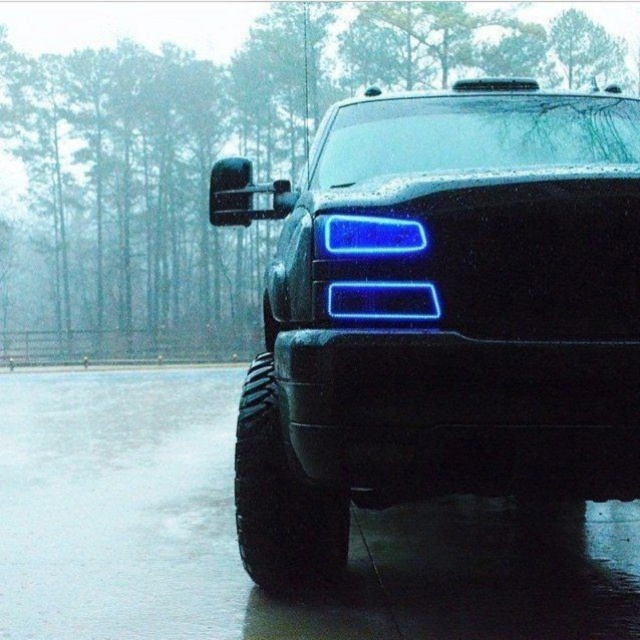
Question: Which of the following is the closest to the observer?

Choices:
 (A) blue plastic headlights at center
 (B) blue glossy rectangle at center

Answer: (B)

Question: Which of the following is the farthest from the observer?

Choices:
 (A) blue plastic headlights at center
 (B) blue glossy rectangle at center

Answer: (A)

Question: Which of the following is the closest to the observer?

Choices:
 (A) (432, 316)
 (B) (486, 321)

Answer: (A)

Question: Is blue plastic headlights at center thinner than blue glossy rectangle at center?

Choices:
 (A) no
 (B) yes

Answer: (A)

Question: Considering the relative positions of blue plastic headlights at center and blue glossy rectangle at center in the image provided, where is blue plastic headlights at center located with respect to blue glossy rectangle at center?

Choices:
 (A) above
 (B) below

Answer: (A)

Question: Can you confirm if blue plastic headlights at center is smaller than blue glossy rectangle at center?

Choices:
 (A) no
 (B) yes

Answer: (A)